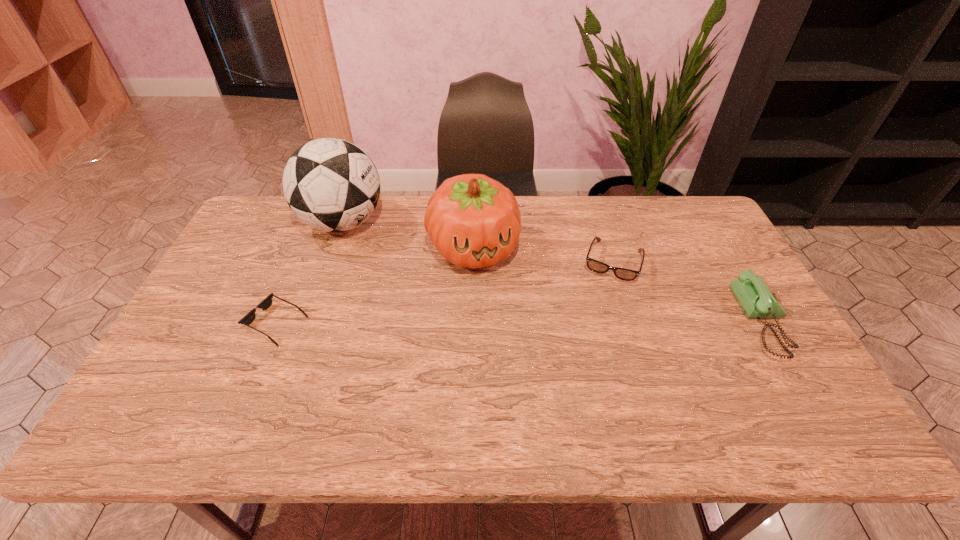
This screenshot has height=540, width=960. What are the coordinates of `sunglasses` in the screenshot? It's located at (248, 319).

Identify the location of the third shortest object. (757, 300).

Identify the location of the rightmost object. The height and width of the screenshot is (540, 960). (757, 300).

Locate an element on the screen. the second object from right to left is located at coordinates point(596,266).

Identify the location of spectacles. (596, 266).

This screenshot has height=540, width=960. I want to click on the third object from right to left, so click(x=474, y=221).

At what (x,y) coordinates should I click in order to perform the action: click on soccer ball. Please return your answer as a coordinate pair (x, y). Image resolution: width=960 pixels, height=540 pixels. Looking at the image, I should click on (330, 184).

Where is `vacant region located 0.050m on the lenses of the shortest object`? This screenshot has height=540, width=960. vacant region located 0.050m on the lenses of the shortest object is located at coordinates (228, 323).

Locate an element on the screen. free spot located 0.160m on the lenses of the shortest object is located at coordinates (186, 323).

Find the location of a particular element. This screenshot has width=960, height=540. free point located 0.060m on the lenses of the shortest object is located at coordinates (224, 323).